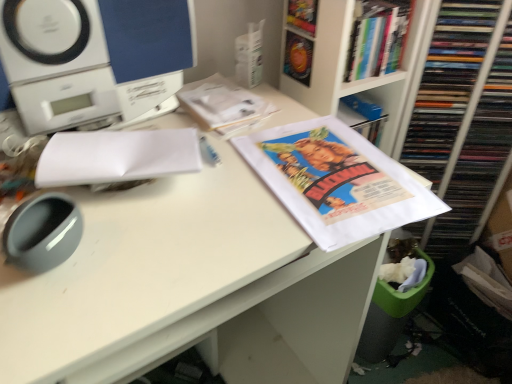
Question: Considering the positions of point (357, 324) and point (219, 74), is point (357, 324) closer or farther from the camera than point (219, 74)?

Choices:
 (A) farther
 (B) closer

Answer: (B)

Question: Would you say white paper at center is to the left or to the right of white paper at upper center, which appears as the first book when ordered from the bottom, in the picture?

Choices:
 (A) left
 (B) right

Answer: (A)

Question: Which object is positioned farthest from the white glossy bookcase at upper right?

Choices:
 (A) hardcover book at upper right, which is the first book in top-to-bottom order
 (B) matte paper poster at center
 (C) white paper at upper center, the first book when ordered from left to right
 (D) white paper at left
 (E) white plastic speaker at upper left

Answer: (D)

Question: Estimate the real-world distances between objects in this image. Which object is farther from the white paper at upper center, marked as the second book in a top-to-bottom arrangement?

Choices:
 (A) matte paper poster at center
 (B) white glossy bookcase at upper right
 (C) hardcover book at upper right, the 2th book positioned from the bottom
 (D) white paper at center
 (E) white plastic speaker at upper left

Answer: (B)